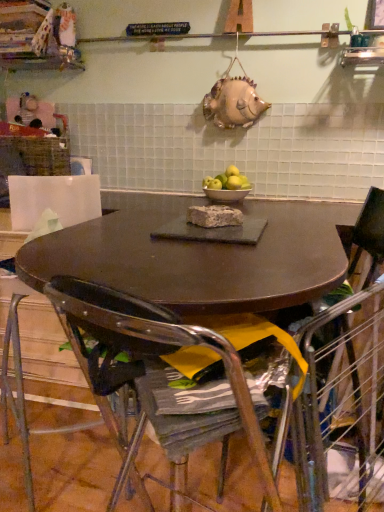
Locate an element on the screen. metallic wire armchair at lower right is located at coordinates [x=342, y=406].

Find the location of a particular element. Image resolution: width=384 pixels, height=512 pixels. brown crumbly cake at center is located at coordinates (214, 216).

In order to face metallic silver chair at lower center, marked as the second chair in a back-to-front arrangement, should I rotate leftwards or rightwards?

You should rotate left by 2.333 degrees.

This screenshot has height=512, width=384. Describe the element at coordinates (153, 377) in the screenshot. I see `metallic silver chair at lower center, the 1th chair from the front` at that location.

You are a GUI agent. You are given a task and a screenshot of the screen. Output one action in this format:
    pyautogui.click(x=<x>, y=<y>)
    Task: Click on the white ceramic bowl at center
    Image resolution: width=384 pixels, height=512 pixels.
    Given the screenshot: What is the action you would take?
    pyautogui.click(x=226, y=194)

Is brown crumbly cake at center positioned beyond the bounds of metallic wire armchair at lower right?

Yes, brown crumbly cake at center is located beyond the bounds of metallic wire armchair at lower right.

Considering the sizes of objects brown crumbly cake at center and metallic wire armchair at lower right in the image provided, who is smaller, brown crumbly cake at center or metallic wire armchair at lower right?

Smaller between the two is brown crumbly cake at center.

Consider the image. Considering the positions of objects brown crumbly cake at center and metallic wire armchair at lower right in the image provided, who is more to the right, brown crumbly cake at center or metallic wire armchair at lower right?

From the viewer's perspective, metallic wire armchair at lower right appears more on the right side.

From a real-world perspective, is brown crumbly cake at center under metallic wire armchair at lower right?

No, from a real-world perspective, brown crumbly cake at center is not below metallic wire armchair at lower right.

From the image's perspective, between metallic wire chair at lower right, the 2th chair from the front, and metallic wire armchair at lower right, which one is located above?

metallic wire chair at lower right, the 2th chair from the front, appears higher in the image.

Considering the sizes of objects metallic wire chair at lower right, the 2th chair from the front, and metallic wire armchair at lower right in the image provided, who is thinner, metallic wire chair at lower right, the 2th chair from the front, or metallic wire armchair at lower right?

With smaller width is metallic wire armchair at lower right.

Is point (301, 349) closer or farther from the camera than point (339, 306)?

Point (301, 349) appears to be closer to the viewer than point (339, 306).

Is metallic wire armchair at lower right completely or partially inside metallic wire chair at lower right, the 1th chair from the back?

No, metallic wire armchair at lower right is not inside metallic wire chair at lower right, the 1th chair from the back.

At what (x,y) coordinates should I click in order to perform the action: click on chair lying in front of the metallic wire armchair at lower right. Please return your answer as a coordinate pair (x, y). Looking at the image, I should click on (153, 377).

From the image's perspective, between metallic wire armchair at lower right and metallic silver chair at lower center, marked as the second chair in a back-to-front arrangement, who is located below?

From the image's view, metallic wire armchair at lower right is below.

Considering the sizes of metallic wire armchair at lower right and metallic silver chair at lower center, the 1th chair from the front, in the image, is metallic wire armchair at lower right bigger or smaller than metallic silver chair at lower center, the 1th chair from the front,?

In the image, metallic wire armchair at lower right appears to be larger than metallic silver chair at lower center, the 1th chair from the front.

Is point (317, 391) positioned after point (99, 301)?

Yes.

Which of these two, yellow matte apples at center or white ceramic bowl at center, stands shorter?

With less height is white ceramic bowl at center.

Is point (209, 185) positioned before point (213, 200)?

No, it is behind (213, 200).

Would you say yellow matte apples at center is to the left or to the right of white ceramic bowl at center in the picture?

Based on their positions, yellow matte apples at center is located to the left of white ceramic bowl at center.

From a real-world perspective, between yellow matte apples at center and white ceramic bowl at center, who is vertically lower?

white ceramic bowl at center is physically lower.

Based on the photo, from a real-world perspective, is metallic silver chair at lower center, marked as the second chair in a back-to-front arrangement, over brown crumbly cake at center?

Actually, metallic silver chair at lower center, marked as the second chair in a back-to-front arrangement, is physically below brown crumbly cake at center in the real world.

Based on the photo, is metallic silver chair at lower center, the 1th chair from the front, smaller than brown crumbly cake at center?

No, metallic silver chair at lower center, the 1th chair from the front, is not smaller than brown crumbly cake at center.

Is metallic silver chair at lower center, marked as the second chair in a back-to-front arrangement, shorter than brown crumbly cake at center?

Incorrect, the height of metallic silver chair at lower center, marked as the second chair in a back-to-front arrangement, does not fall short of that of brown crumbly cake at center.

Is metallic silver chair at lower center, marked as the second chair in a back-to-front arrangement, outside of brown crumbly cake at center?

Yes.

Can you confirm if white ceramic bowl at center is taller than metallic wire chair at lower right, the 1th chair from the back?

Incorrect, the height of white ceramic bowl at center is not larger of that of metallic wire chair at lower right, the 1th chair from the back.

Would you say white ceramic bowl at center is a long distance from metallic wire chair at lower right, the 2th chair from the front?

They are positioned close to each other.

Considering the positions of point (248, 190) and point (269, 417), is point (248, 190) closer or farther from the camera than point (269, 417)?

Point (248, 190) is farther from the camera than point (269, 417).

Is white ceramic bowl at center positioned with its back to metallic wire chair at lower right, the 2th chair from the front?

No, metallic wire chair at lower right, the 2th chair from the front, is not at the back of white ceramic bowl at center.

Considering the relative positions of metallic wire chair at lower right, the 2th chair from the front, and white ceramic bowl at center in the image provided, is metallic wire chair at lower right, the 2th chair from the front, to the right of white ceramic bowl at center from the viewer's perspective?

Correct, you'll find metallic wire chair at lower right, the 2th chair from the front, to the right of white ceramic bowl at center.

Find the location of `bowl that is above the metallic wire chair at lower right, the 2th chair from the front (from the image's perspective)`. bowl that is above the metallic wire chair at lower right, the 2th chair from the front (from the image's perspective) is located at coordinates (226, 194).

Considering the positions of objects metallic wire chair at lower right, the 1th chair from the back, and white ceramic bowl at center in the image provided, who is behind, metallic wire chair at lower right, the 1th chair from the back, or white ceramic bowl at center?

white ceramic bowl at center is more distant.

Can you tell me how much metallic wire chair at lower right, the 1th chair from the back, and white ceramic bowl at center differ in facing direction?

The angular difference between metallic wire chair at lower right, the 1th chair from the back, and white ceramic bowl at center is 90 degrees.

Locate an element on the screen. Image resolution: width=384 pixels, height=512 pixels. armchair below the brown crumbly cake at center (from a real-world perspective) is located at coordinates (342, 406).

Identify the location of chair that is the 1st object above the metallic wire armchair at lower right (from a real-world perspective). [x=344, y=384].

Based on their spatial positions, is brown crumbly cake at center or metallic silver chair at lower center, the 1th chair from the front, closer to metallic wire chair at lower right, the 1th chair from the back?

Among the two, metallic silver chair at lower center, the 1th chair from the front, is located nearer to metallic wire chair at lower right, the 1th chair from the back.

From the image, which object appears to be farther from metallic wire chair at lower right, the 1th chair from the back, brown crumbly cake at center or metallic wire armchair at lower right?

brown crumbly cake at center is further to metallic wire chair at lower right, the 1th chair from the back.

When comparing their distances from metallic silver chair at lower center, marked as the second chair in a back-to-front arrangement, does white ceramic bowl at center or brown crumbly cake at center seem closer?

brown crumbly cake at center is positioned closer to the anchor metallic silver chair at lower center, marked as the second chair in a back-to-front arrangement.

Estimate the real-world distances between objects in this image. Which object is further from yellow matte apples at center, brown crumbly cake at center or white ceramic bowl at center?

brown crumbly cake at center is further to yellow matte apples at center.

Which object lies nearer to the anchor point yellow matte apples at center, white ceramic bowl at center or brown crumbly cake at center?

Based on the image, white ceramic bowl at center appears to be nearer to yellow matte apples at center.

When comparing their distances from white ceramic bowl at center, does yellow matte apples at center or brown crumbly cake at center seem closer?

Among the two, yellow matte apples at center is located nearer to white ceramic bowl at center.

Estimate the real-world distances between objects in this image. Which object is closer to yellow matte apples at center, metallic wire chair at lower right, the 1th chair from the back, or metallic wire armchair at lower right?

metallic wire chair at lower right, the 1th chair from the back, lies closer to yellow matte apples at center than the other object.

Estimate the real-world distances between objects in this image. Which object is further from brown crumbly cake at center, white ceramic bowl at center or metallic silver chair at lower center, the 1th chair from the front?

Based on the image, metallic silver chair at lower center, the 1th chair from the front, appears to be further to brown crumbly cake at center.

The height and width of the screenshot is (512, 384). In order to click on chair between metallic silver chair at lower center, marked as the second chair in a back-to-front arrangement, and white ceramic bowl at center, along the z-axis in this screenshot , I will do `click(344, 384)`.

This screenshot has width=384, height=512. Find the location of `armchair between metallic silver chair at lower center, the 1th chair from the front, and brown crumbly cake at center from front to back`. armchair between metallic silver chair at lower center, the 1th chair from the front, and brown crumbly cake at center from front to back is located at coordinates (342, 406).

Where is `food located between metallic silver chair at lower center, marked as the second chair in a back-to-front arrangement, and white ceramic bowl at center in the depth direction`? The height and width of the screenshot is (512, 384). food located between metallic silver chair at lower center, marked as the second chair in a back-to-front arrangement, and white ceramic bowl at center in the depth direction is located at coordinates coord(214,216).

Locate an element on the screen. Image resolution: width=384 pixels, height=512 pixels. food between metallic wire armchair at lower right and white ceramic bowl at center in the front-back direction is located at coordinates (214, 216).